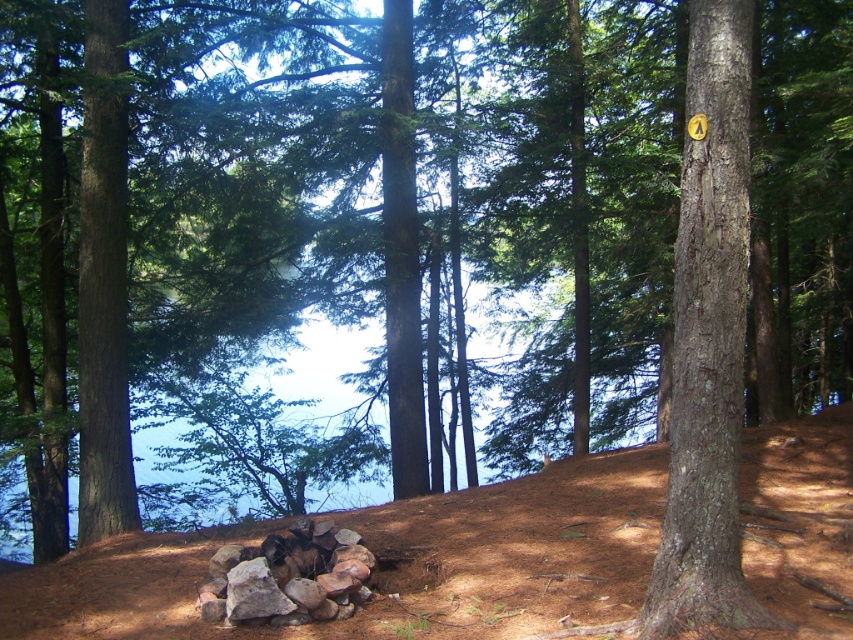
Based on the photo, you are a hiker trying to navigate through the forest. You see the brown dirt hillside at center and the smooth brown tree trunk at right. Which one is taller?

The smooth brown tree trunk at right is taller than the brown dirt hillside at center.

You are a hiker trying to reach the smooth brown tree trunk at right but there is a brown dirt hillside at center in your way. Can you walk directly to the tree trunk without going around the hillside?

The brown dirt hillside at center is in front of the smooth brown tree trunk at right, so you cannot walk directly to the tree trunk without going around the hillside.